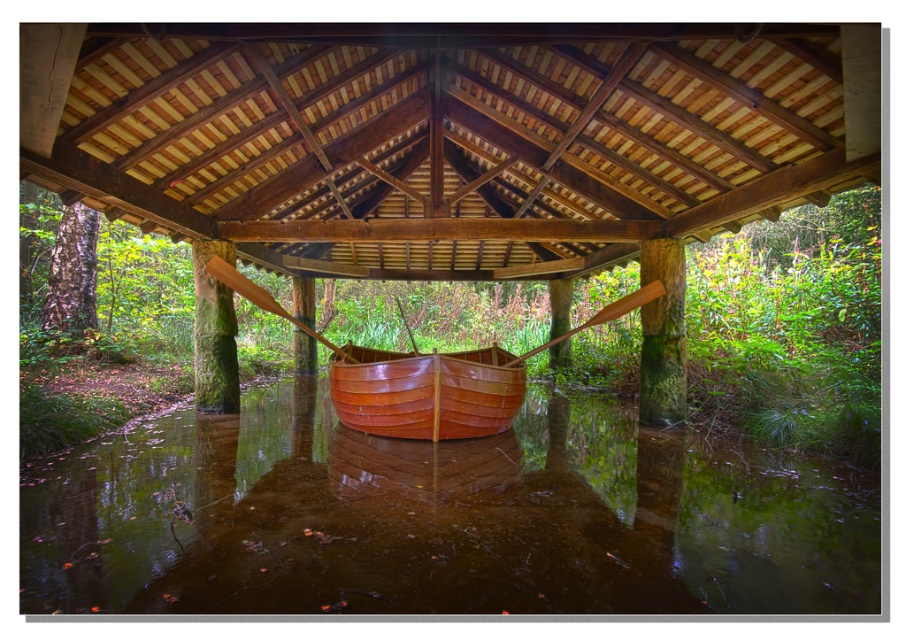
You are standing at the entrance of the boathouse and see both the glossy wooden boat at center and the shiny brown canoe at center. Which one is positioned lower in the scene?

The glossy wooden boat at center is positioned lower than the shiny brown canoe at center.

You are a painter standing at the edge of the scene and want to paint both the glossy wooden boat at center and the shiny brown canoe at center. Given that your painting canvas is 2 meters wide, can you fit both objects on the canvas without overlapping them?

The glossy wooden boat at center and shiny brown canoe at center are 1.86 meters apart. Since the distance between them is less than the 2 meters width of the canvas, they can be placed side by side on the canvas without overlapping.